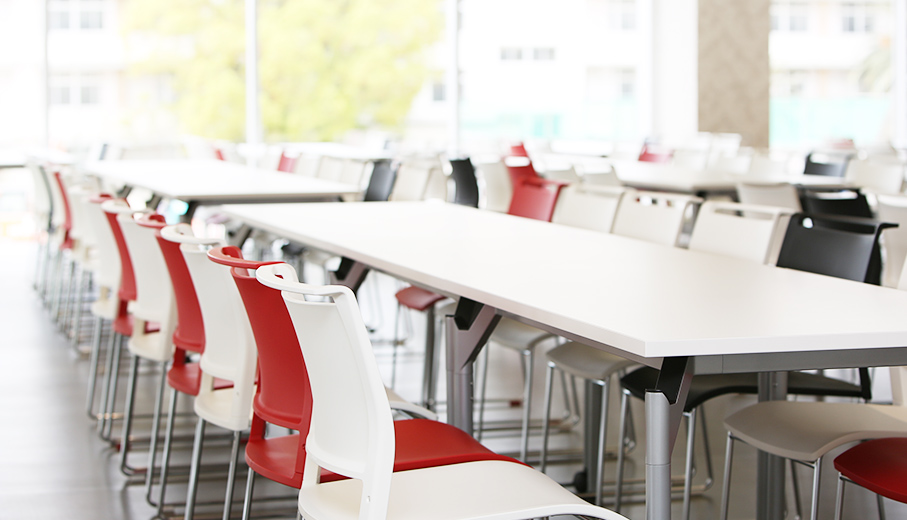
You are a GUI agent. You are given a task and a screenshot of the screen. Output one action in this format:
    pyautogui.click(x=<x>, y=<y>)
    Task: Click on the table
    The height and width of the screenshot is (520, 907).
    Given the screenshot: What is the action you would take?
    pyautogui.click(x=617, y=304), pyautogui.click(x=886, y=200), pyautogui.click(x=639, y=170), pyautogui.click(x=207, y=177)